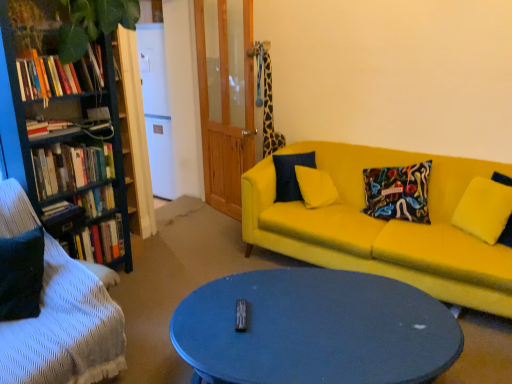
Question: Is hardcover book at left, the 1th book positioned from the bottom, oriented towards wooden bookshelf at left?

Choices:
 (A) no
 (B) yes

Answer: (B)

Question: Is hardcover book at left, which appears as the fifth book when viewed from the top, bigger than wooden bookshelf at left?

Choices:
 (A) yes
 (B) no

Answer: (B)

Question: Can you confirm if hardcover book at left, which appears as the fifth book when viewed from the top, is positioned to the left of wooden bookshelf at left?

Choices:
 (A) no
 (B) yes

Answer: (B)

Question: Is hardcover book at left, the 1th book positioned from the bottom, closer to camera compared to wooden bookshelf at left?

Choices:
 (A) no
 (B) yes

Answer: (A)

Question: From a real-world perspective, is hardcover book at left, the 1th book positioned from the bottom, below wooden bookshelf at left?

Choices:
 (A) no
 (B) yes

Answer: (B)

Question: Would you say hardcover books at left, which is the 2th book in top-to-bottom order, is to the left or to the right of hardcover books at left, placed as the first book when sorted from top to bottom, in the picture?

Choices:
 (A) right
 (B) left

Answer: (B)

Question: From a real-world perspective, is hardcover books at left, which is the 2th book in top-to-bottom order, above or below hardcover books at left, placed as the first book when sorted from top to bottom?

Choices:
 (A) below
 (B) above

Answer: (A)

Question: Considering the positions of hardcover books at left, which is the 2th book in top-to-bottom order, and hardcover books at left, placed as the first book when sorted from top to bottom, in the image, is hardcover books at left, which is the 2th book in top-to-bottom order, bigger or smaller than hardcover books at left, placed as the first book when sorted from top to bottom,?

Choices:
 (A) big
 (B) small

Answer: (B)

Question: Looking at their shapes, would you say hardcover books at left, which is the 2th book in top-to-bottom order, is wider or thinner than hardcover books at left, placed as the first book when sorted from top to bottom?

Choices:
 (A) wide
 (B) thin

Answer: (A)

Question: From the image's perspective, is hardcover books at left, placed as the first book when sorted from top to bottom, located above or below hardcover book at left, which appears as the fifth book when viewed from the top?

Choices:
 (A) above
 (B) below

Answer: (A)

Question: Considering the positions of hardcover books at left, placed as the first book when sorted from top to bottom, and hardcover book at left, the 1th book positioned from the bottom, in the image, is hardcover books at left, placed as the first book when sorted from top to bottom, bigger or smaller than hardcover book at left, the 1th book positioned from the bottom,?

Choices:
 (A) small
 (B) big

Answer: (B)

Question: Is hardcover books at left, acting as the fifth book starting from the bottom, in front of or behind hardcover book at left, the 1th book positioned from the bottom, in the image?

Choices:
 (A) behind
 (B) front

Answer: (B)

Question: Is point (82, 71) positioned closer to the camera than point (67, 206)?

Choices:
 (A) farther
 (B) closer

Answer: (B)

Question: Is point (34, 132) positioned closer to the camera than point (355, 311)?

Choices:
 (A) farther
 (B) closer

Answer: (A)

Question: Considering the relative positions of hardcover books at left, which is the 2th book in top-to-bottom order, and matte blue coffee table at center in the image provided, is hardcover books at left, which is the 2th book in top-to-bottom order, to the left or to the right of matte blue coffee table at center?

Choices:
 (A) left
 (B) right

Answer: (A)